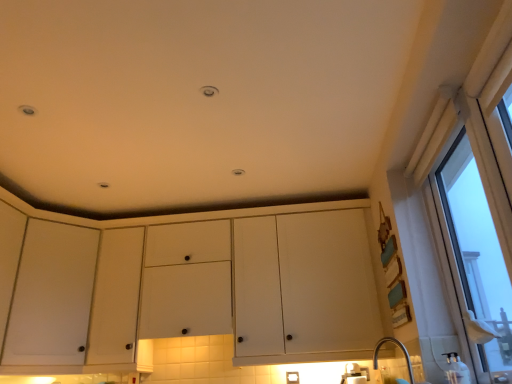
Question: In terms of height, does clear glass window at right look taller or shorter compared to white matte cabinet at left?

Choices:
 (A) tall
 (B) short

Answer: (A)

Question: Would you say clear glass window at right is to the left or to the right of white matte cabinet at left in the picture?

Choices:
 (A) right
 (B) left

Answer: (A)

Question: Estimate the real-world distances between objects in this image. Which object is closer to the white matte cabinet at left?

Choices:
 (A) clear glass window at right
 (B) white matte cabinet at center

Answer: (B)

Question: Based on their relative distances, which object is farther from the white matte cabinet at center?

Choices:
 (A) clear glass window at right
 (B) white matte cabinet at left

Answer: (A)